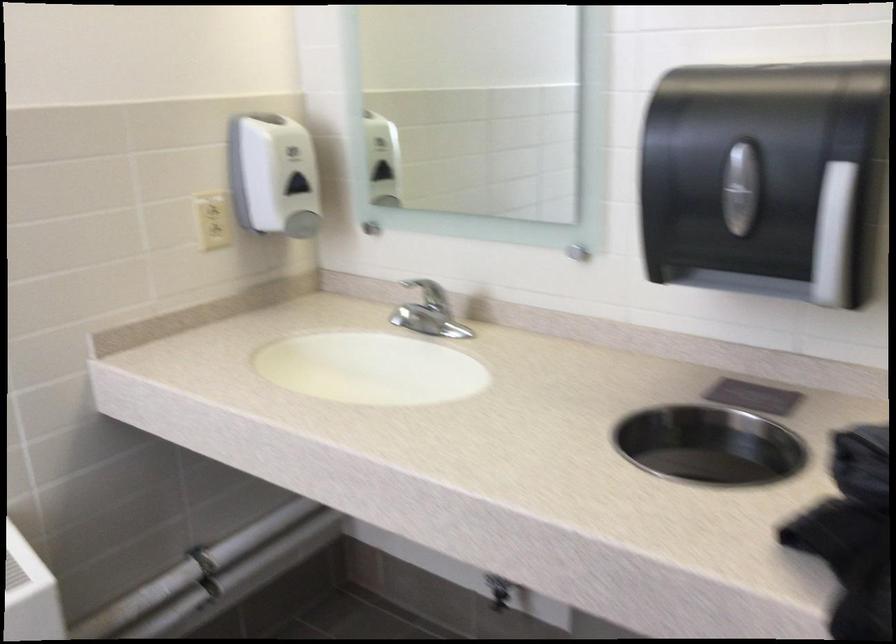
Based on the continuous images, in which direction is the camera rotating?

The camera rotated toward left-down.